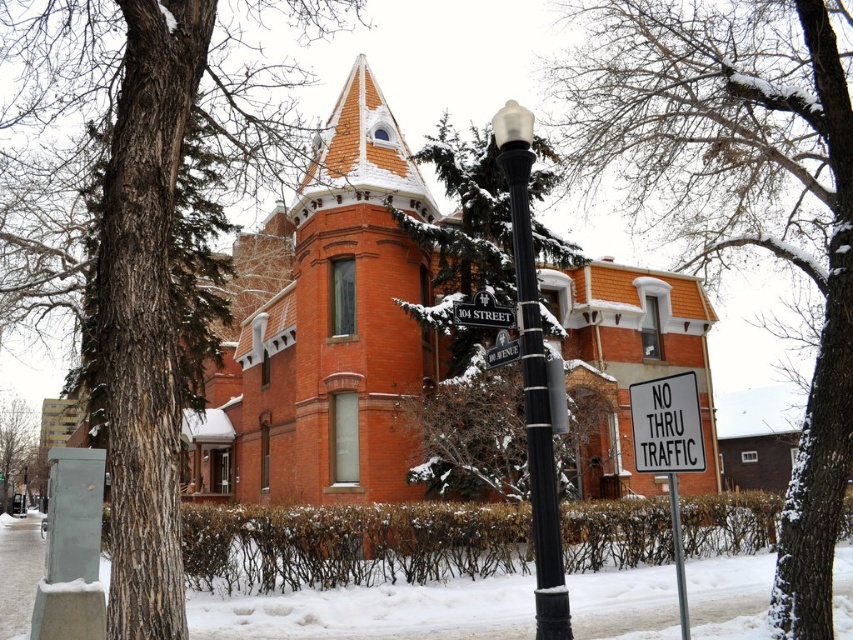
Does black metal lamp post at center have a lesser width compared to white plastic sign at lower right?

Yes, black metal lamp post at center is thinner than white plastic sign at lower right.

Between black metal lamp post at center and white plastic sign at lower right, which one appears on the left side from the viewer's perspective?

black metal lamp post at center is more to the left.

Is point (531, 262) farther from viewer compared to point (674, 404)?

No, (531, 262) is in front of (674, 404).

Image resolution: width=853 pixels, height=640 pixels. I want to click on black metal lamp post at center, so pyautogui.click(x=532, y=378).

Who is more forward, (10, 497) or (453, 314)?

Positioned in front is point (453, 314).

What do you see at coordinates (13, 445) in the screenshot? I see `brown bark tree at lower left` at bounding box center [13, 445].

You are a GUI agent. You are given a task and a screenshot of the screen. Output one action in this format:
    pyautogui.click(x=<x>, y=<y>)
    Task: Click on the brown bark tree at lower left
    
    Given the screenshot: What is the action you would take?
    pyautogui.click(x=13, y=445)

Can you confirm if snow-covered evergreen at center is positioned to the left of black metal lamp post at center?

Incorrect, snow-covered evergreen at center is not on the left side of black metal lamp post at center.

Who is higher up, snow-covered evergreen at center or black metal lamp post at center?

snow-covered evergreen at center

Is point (415, 227) less distant than point (535, 362)?

No, (415, 227) is behind (535, 362).

Identify the location of snow-covered evergreen at center. (467, 216).